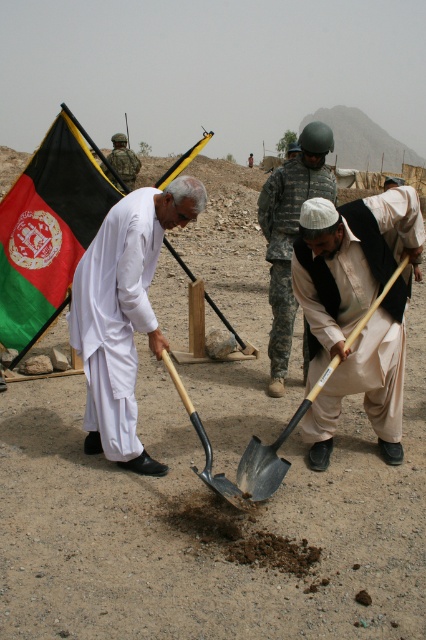
You are a photographer standing at the ceremony site. You want to capture a photo of the green and black fabric flag at upper left. Given that your camera has a maximum focus range of 5 meters, will you be able to focus on the flag without moving closer?

The green and black fabric flag at upper left is 5.64 meters away from the camera. Since the camera can only focus up to 5 meters, you won generated question and answer based on the provided information. 4 meters, you won generated question and answer based on the provided information. 4 meters, you will not be able to focus on the flag without moving closer.

You are a photographer at the groundbreaking ceremony. You need to position yourself so that the green and black fabric flag at upper left and the camouflage uniform at center are both visible in your shot. Based on their positions, which object should appear lower in the photo?

The green and black fabric flag at upper left should appear lower in the photo because it is located below the camouflage uniform at center.

You are a photographer at the groundbreaking ceremony. You want to capture a photo where both the white cotton shirt at center and the metallic shovel at center are clearly visible. Based on their positions, which object should you focus on first to ensure both are in focus?

Since the white cotton shirt at center is in front of the metallic shovel at center, you should focus on the white cotton shirt at center first to ensure both are in focus.